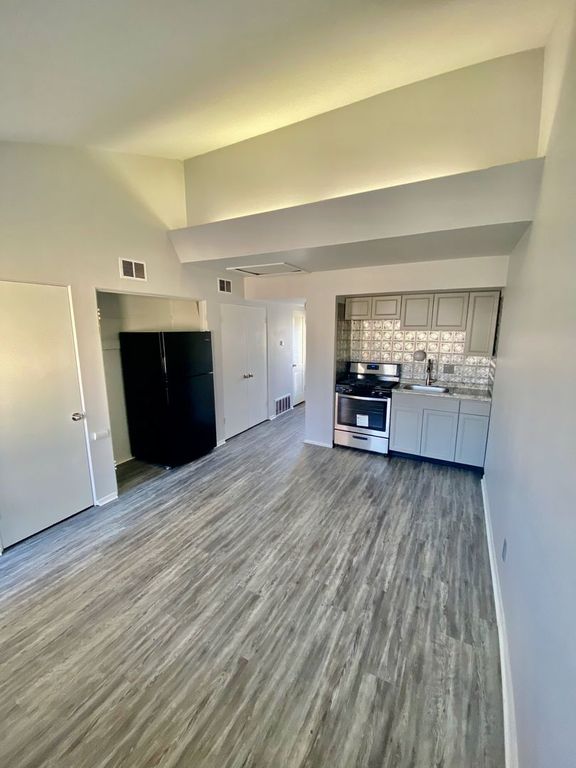
At what (x,y) coordinates should I click in order to perform the action: click on floor. Please return your answer as a coordinate pair (x, y). Image resolution: width=576 pixels, height=768 pixels. Looking at the image, I should click on (306, 641).